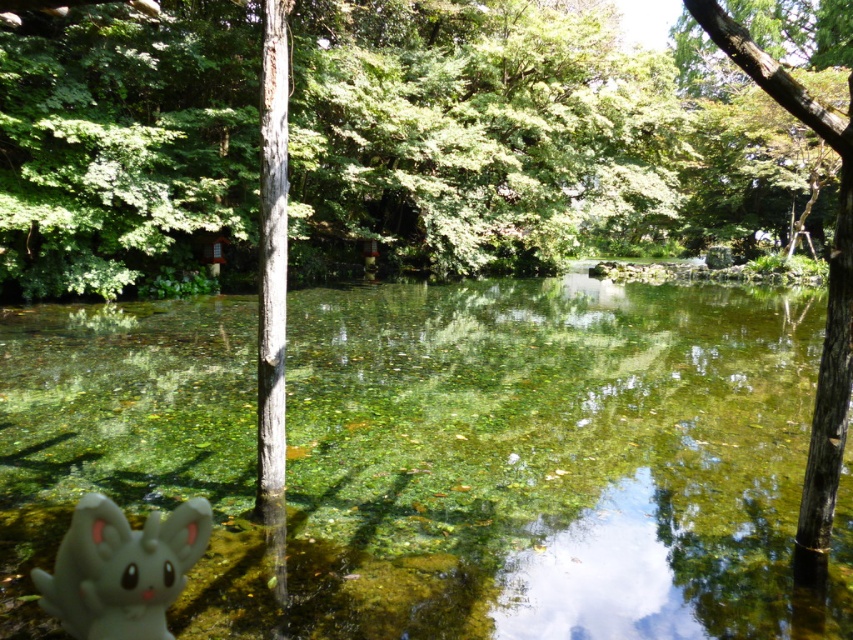
You are standing at the center of the image and want to place a new decorative rock exactly where the white rubber toy at lower left is currently located. What are the coordinates where you should place the rock?

The coordinates for placing the decorative rock should be at point (120, 568), which is the current location of the white rubber toy at lower left.

You are trying to determine the spatial relationship between the clear glass water at center and the white rubber toy at lower left. Which object is wider?

The clear glass water at center is wider than the white rubber toy at lower left.